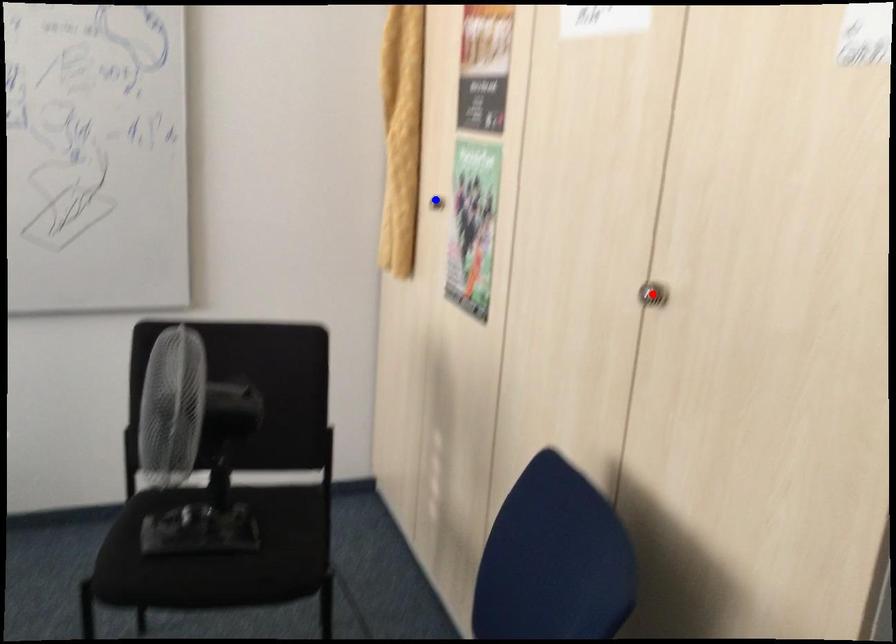
Question: In the image, two points are highlighted. Which point is nearer to the camera? Reply with the corresponding letter.

Choices:
 (A) blue point
 (B) red point

Answer: (B)